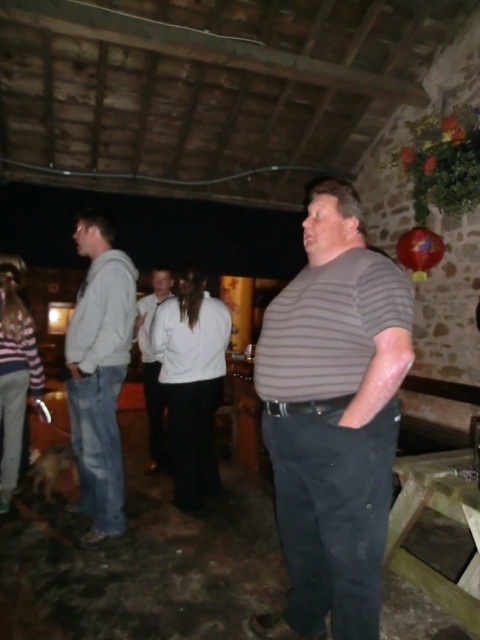
Question: Is light gray hoodie at left to the right of white matte jacket at center from the viewer's perspective?

Choices:
 (A) yes
 (B) no

Answer: (B)

Question: Which of the following is the closest to the observer?

Choices:
 (A) (144, 326)
 (B) (339, 228)
 (C) (97, 234)

Answer: (B)

Question: Can you confirm if gray striped shirt at center is positioned to the right of light gray hoodie at left?

Choices:
 (A) yes
 (B) no

Answer: (A)

Question: Which point is closer to the camera?

Choices:
 (A) light gray hoodie at left
 (B) gray striped shirt at center

Answer: (B)

Question: Which point appears closest to the camera in this image?

Choices:
 (A) click(315, 634)
 (B) click(156, 403)

Answer: (A)

Question: Is gray striped shirt at center further to camera compared to light gray hoodie at left?

Choices:
 (A) no
 (B) yes

Answer: (A)